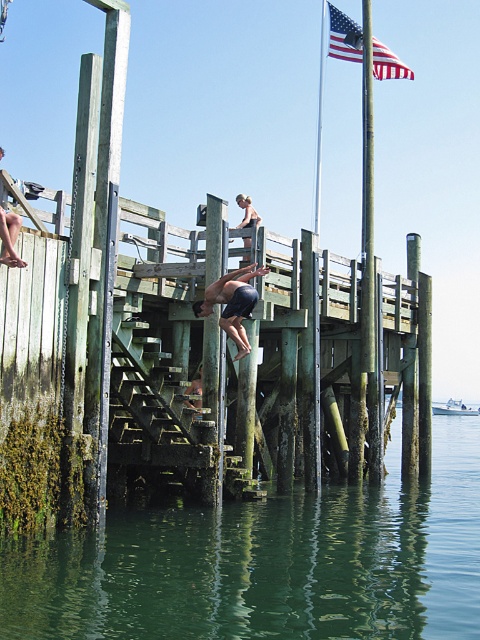
You are planning to place a small bench on the dock. Based on the image, which object, the green weathered wood dock at center or the american flag at upper center, is more suitable for placing the bench and why?

The green weathered wood dock at center is more suitable for placing the bench because it is wider than the american flag at upper center, providing enough space for the bench to be placed securely.

You are standing on the dock and want to see both the green mossy water at lower center and the american flag at upper center. Which object is closer to your eye level?

The green mossy water at lower center is closer to your eye level than the american flag at upper center because it has a lesser height.